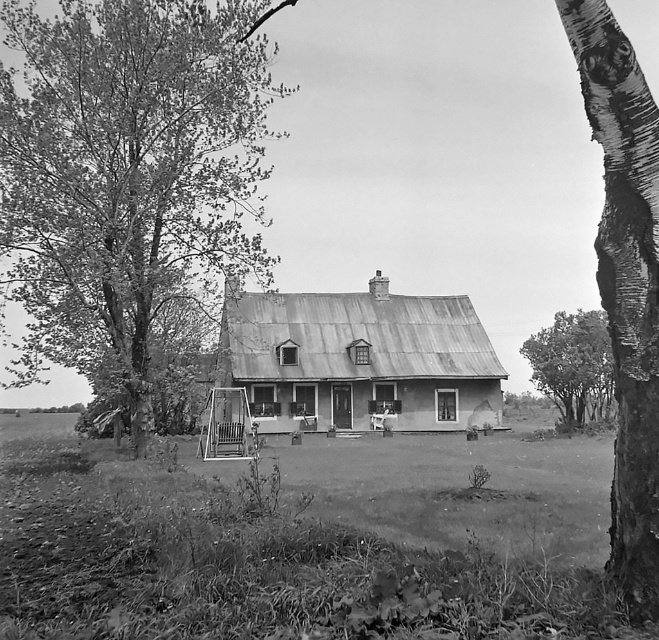
You are standing on the porch of the house and want to look at both the smooth bark tree at left and the smooth bark birch tree at right. Which tree is closer to you?

The smooth bark tree at left is closer to you because the smooth bark birch tree at right is behind it.

You are standing in front of the house and notice two smooth bark trees. Which tree, the smooth bark tree at left or the smooth bark tree at right, is closer to you?

The smooth bark tree at left is closer to you because it is in front of the smooth bark tree at right.

You are standing in the middle of the front yard of the house and want to walk to the smooth bark tree at left and the smooth bark tree at right. Which tree will you reach first if you walk straight ahead?

The smooth bark tree at left is positioned over the smooth bark tree at right, so you will reach the smooth bark tree at left first.